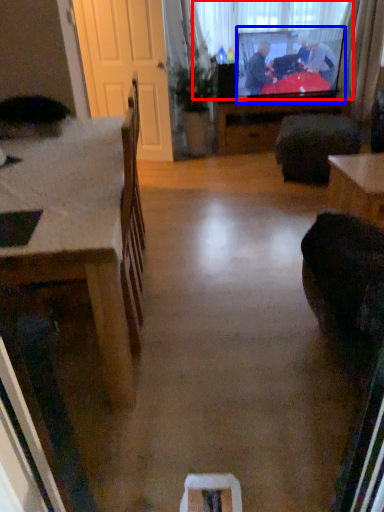
Question: Which of the following is the closest to the observer, window screen (highlighted by a red box) or television (highlighted by a blue box)?

Choices:
 (A) window screen
 (B) television

Answer: (B)